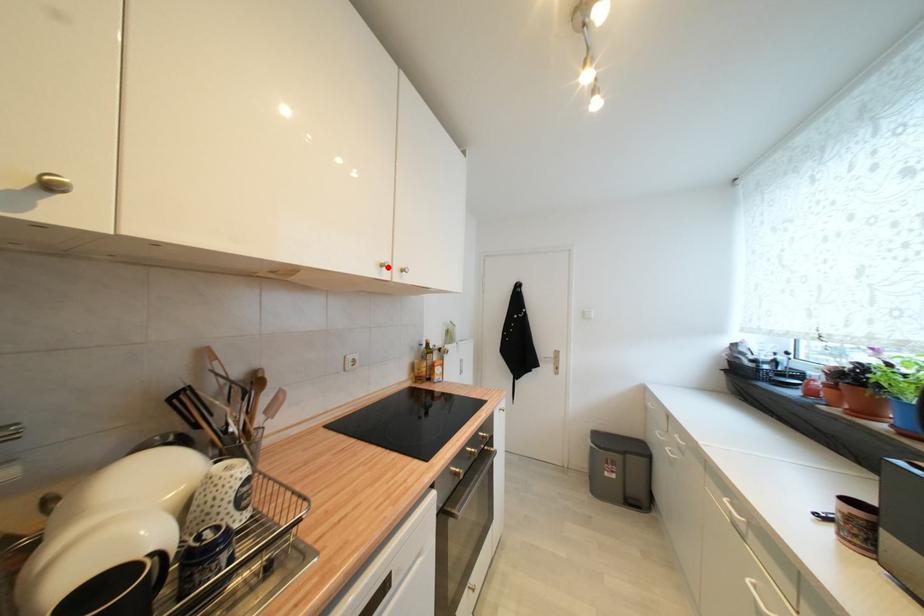
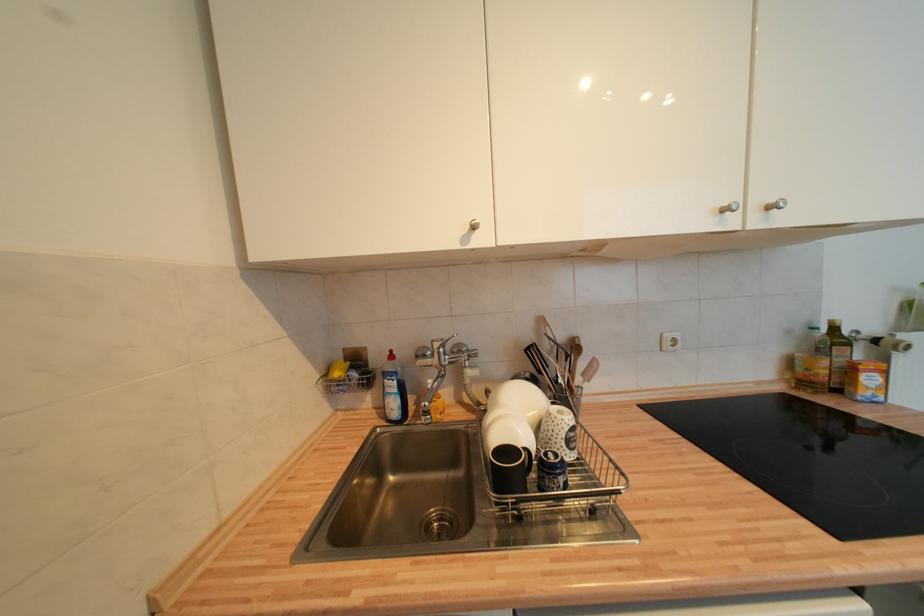
In the second image, find the point that corresponds to the highlighted location in the first image.

(730, 212)